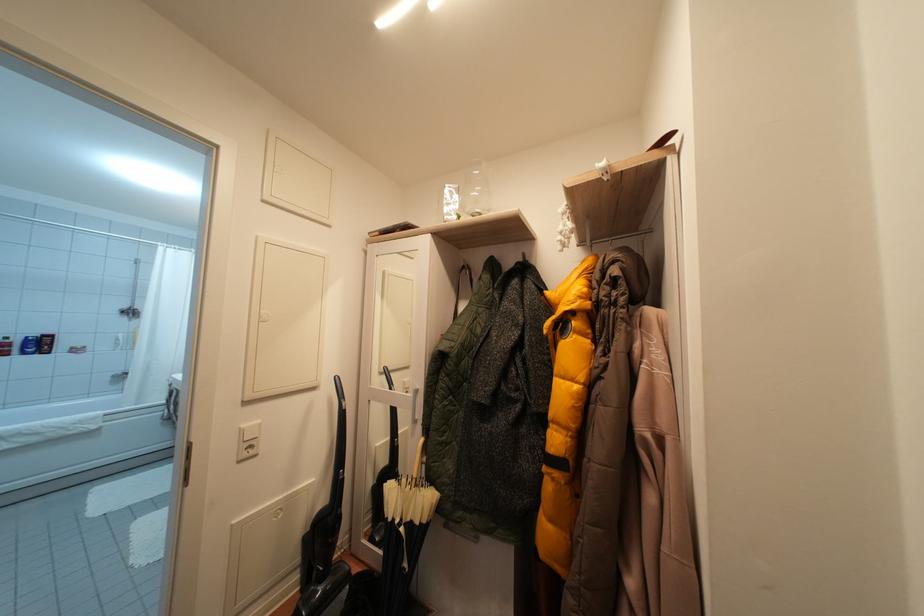
Find where to hang the metal clothing rod. Please return your answer as a coordinate pair (x, y).

(614, 237)